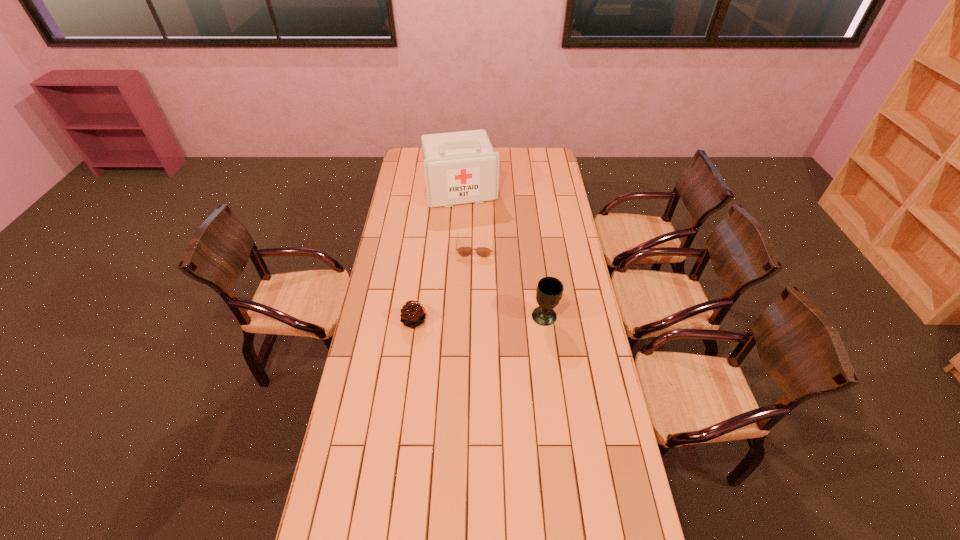
Identify the location of vacant space positioned 0.180m on the front-facing side of the farthest object. This screenshot has height=540, width=960. (473, 231).

Find the location of a particular element. This screenshot has width=960, height=540. free region located 0.110m on the front-facing side of the farthest object is located at coordinates (470, 222).

Image resolution: width=960 pixels, height=540 pixels. I want to click on vacant area located on the front-facing side of the second farthest object, so click(471, 288).

This screenshot has width=960, height=540. Find the location of `vacant area situated 0.130m on the front-facing side of the second farthest object`. vacant area situated 0.130m on the front-facing side of the second farthest object is located at coordinates (472, 278).

Locate an element on the screen. free space located 0.080m on the front-facing side of the second farthest object is located at coordinates (473, 270).

Where is `pinecone that is at the left edge`? pinecone that is at the left edge is located at coordinates (413, 314).

Locate an element on the screen. The image size is (960, 540). the first-aid kit that is at the left edge is located at coordinates (462, 167).

Find the location of a particular element. This screenshot has width=960, height=540. object present at the right edge is located at coordinates (549, 291).

Where is `vacant region at the far edge of the desktop`? The image size is (960, 540). vacant region at the far edge of the desktop is located at coordinates (505, 156).

In order to click on vacant region at the left edge of the desktop in this screenshot , I will do `click(393, 306)`.